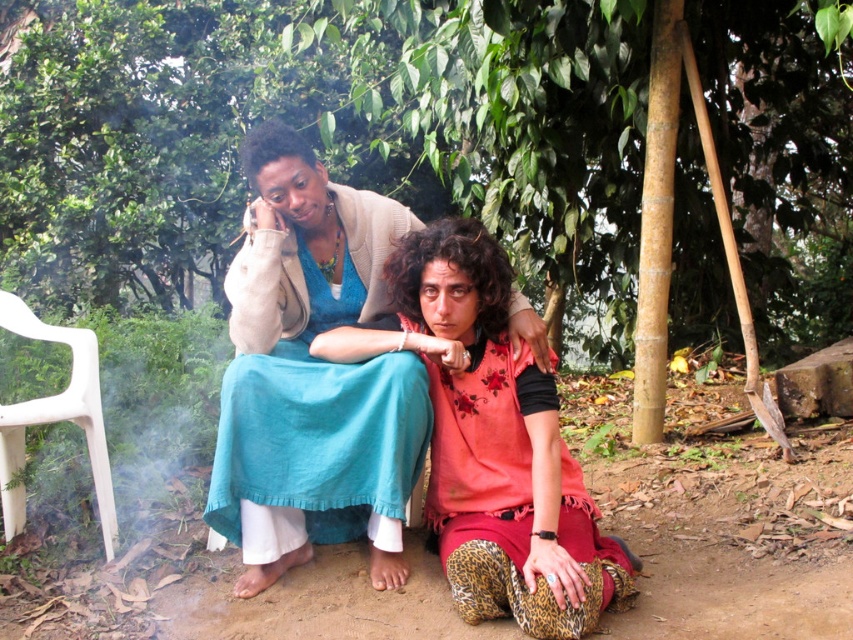
Question: Does matte blue dress at center appear under floral fabric dress at center?

Choices:
 (A) yes
 (B) no

Answer: (B)

Question: Can you confirm if green leafy tree at upper center is thinner than white plastic chair at left?

Choices:
 (A) no
 (B) yes

Answer: (A)

Question: Which point is farther to the camera?

Choices:
 (A) (316, 499)
 (B) (521, 602)
 (C) (616, 44)

Answer: (C)

Question: Considering the real-world distances, which object is farthest from the matte blue dress at center?

Choices:
 (A) green leafy tree at upper center
 (B) white plastic chair at left
 (C) floral fabric dress at center

Answer: (A)

Question: Which object is the closest to the green leafy tree at upper center?

Choices:
 (A) floral fabric dress at center
 (B) matte blue dress at center

Answer: (B)

Question: Does matte blue dress at center lie in front of floral fabric dress at center?

Choices:
 (A) no
 (B) yes

Answer: (A)